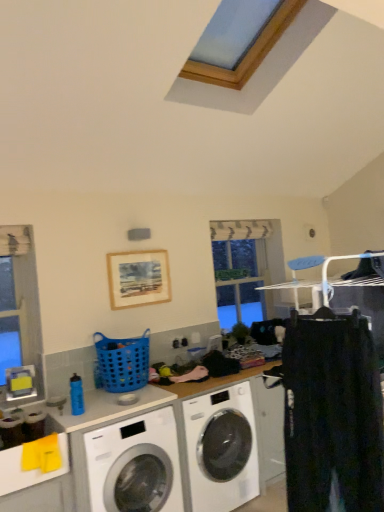
This screenshot has height=512, width=384. What do you see at coordinates (332, 413) in the screenshot?
I see `black cotton pants at right` at bounding box center [332, 413].

This screenshot has width=384, height=512. Describe the element at coordinates (222, 449) in the screenshot. I see `white glossy washing machine at center, the first washing machine in the right-to-left sequence` at that location.

What do you see at coordinates (239, 281) in the screenshot? This screenshot has width=384, height=512. I see `clear glass window at center` at bounding box center [239, 281].

I want to click on wooden picture frame at upper center, so click(138, 278).

Considering the relative positions of blue plastic basket at center and clear glass window at center in the image provided, is blue plastic basket at center to the left of clear glass window at center from the viewer's perspective?

Yes, blue plastic basket at center is to the left of clear glass window at center.

Does point (139, 349) lie in front of point (220, 263)?

Yes.

Is blue plastic basket at center far from clear glass window at center?

blue plastic basket at center is positioned a significant distance from clear glass window at center.

Could you tell me if blue plastic basket at center is facing clear glass window at center?

No, blue plastic basket at center does not turn towards clear glass window at center.

From a real-world perspective, relative to wooden picture frame at upper center, is black cotton pants at right vertically above or below?

black cotton pants at right is situated lower than wooden picture frame at upper center in the real world.

Would you consider black cotton pants at right to be distant from wooden picture frame at upper center?

Yes, black cotton pants at right and wooden picture frame at upper center are located far from each other.

Is black cotton pants at right inside or outside of wooden picture frame at upper center?

black cotton pants at right exists outside the volume of wooden picture frame at upper center.

In the scene shown: Which object is more forward, black cotton pants at right or wooden picture frame at upper center?

Positioned in front is black cotton pants at right.

Considering the relative sizes of clear glass window at center and wooden picture frame at upper center in the image provided, is clear glass window at center thinner than wooden picture frame at upper center?

No.

Is the position of clear glass window at center more distant than that of wooden picture frame at upper center?

Yes, the depth of clear glass window at center is greater than that of wooden picture frame at upper center.

Between clear glass window at center and wooden picture frame at upper center, which one has larger size?

clear glass window at center.

From the image's perspective, is clear glass window at center on top of wooden picture frame at upper center?

No, from the image's perspective, clear glass window at center is not over wooden picture frame at upper center.

Is white glossy washing machine at lower left, which is the second washing machine from right to left, at the left side of wooden picture frame at upper center?

Correct, you'll find white glossy washing machine at lower left, which is the second washing machine from right to left, to the left of wooden picture frame at upper center.

Is white glossy washing machine at lower left, which is the second washing machine from right to left, positioned with its back to wooden picture frame at upper center?

No, white glossy washing machine at lower left, which is the second washing machine from right to left, is not facing the opposite direction of wooden picture frame at upper center.

Can we say white glossy washing machine at lower left, the 1th washing machine in the left-to-right sequence, lies outside wooden picture frame at upper center?

That's correct, white glossy washing machine at lower left, the 1th washing machine in the left-to-right sequence, is outside of wooden picture frame at upper center.

Which is more to the left, white glossy washing machine at center, the 2th washing machine positioned from the left, or blue plastic basket at center?

blue plastic basket at center is more to the left.

How different are the orientations of white glossy washing machine at center, the first washing machine in the right-to-left sequence, and blue plastic basket at center in degrees?

The facing directions of white glossy washing machine at center, the first washing machine in the right-to-left sequence, and blue plastic basket at center are 3.08e-05 degrees apart.

At what (x,y) coordinates should I click in order to perform the action: click on washing machine that is the 1st object located below the blue plastic basket at center (from the image's perspective). Please return your answer as a coordinate pair (x, y). The width and height of the screenshot is (384, 512). Looking at the image, I should click on pyautogui.click(x=222, y=449).

Is white glossy washing machine at center, the first washing machine in the right-to-left sequence, positioned with its back to blue plastic basket at center?

white glossy washing machine at center, the first washing machine in the right-to-left sequence, is not turned away from blue plastic basket at center.

From the image's perspective, which is above, wooden picture frame at upper center or white glossy washing machine at lower left, which is the second washing machine from right to left?

wooden picture frame at upper center appears higher in the image.

Is white glossy washing machine at lower left, the 1th washing machine in the left-to-right sequence, a part of wooden picture frame at upper center?

No, white glossy washing machine at lower left, the 1th washing machine in the left-to-right sequence, is not surrounded by wooden picture frame at upper center.

Does wooden picture frame at upper center have a smaller size compared to white glossy washing machine at lower left, which is the second washing machine from right to left?

Yes, wooden picture frame at upper center is smaller than white glossy washing machine at lower left, which is the second washing machine from right to left.

From a real-world perspective, is white glossy washing machine at center, the first washing machine in the right-to-left sequence, beneath wooden picture frame at upper center?

Yes, from a real-world perspective, white glossy washing machine at center, the first washing machine in the right-to-left sequence, is under wooden picture frame at upper center.

Does white glossy washing machine at center, the 2th washing machine positioned from the left, have a smaller size compared to wooden picture frame at upper center?

Actually, white glossy washing machine at center, the 2th washing machine positioned from the left, might be larger than wooden picture frame at upper center.

Which object is further away from the camera taking this photo, white glossy washing machine at center, the 2th washing machine positioned from the left, or wooden picture frame at upper center?

wooden picture frame at upper center is further away from the camera.

You are a GUI agent. You are given a task and a screenshot of the screen. Output one action in this format:
    pyautogui.click(x=<x>, y=<y>)
    Task: Click on the window screen on the right of blue plastic basket at center
    The width and height of the screenshot is (384, 512).
    Given the screenshot: What is the action you would take?
    pyautogui.click(x=239, y=281)

Where is `picture frame on the left side of black cotton pants at right`? The height and width of the screenshot is (512, 384). picture frame on the left side of black cotton pants at right is located at coordinates (138, 278).

When comparing their distances from clear glass window at center, does white glossy washing machine at center, the 2th washing machine positioned from the left, or white glossy washing machine at lower left, which is the second washing machine from right to left, seem further?

white glossy washing machine at lower left, which is the second washing machine from right to left, is further to clear glass window at center.

When comparing their distances from wooden picture frame at upper center, does clear glass window at center or white glossy washing machine at center, the 2th washing machine positioned from the left, seem further?

white glossy washing machine at center, the 2th washing machine positioned from the left, is further to wooden picture frame at upper center.

Which object lies nearer to the anchor point white glossy washing machine at lower left, which is the second washing machine from right to left, blue plastic basket at center or white glossy washing machine at center, the 2th washing machine positioned from the left?

The object closer to white glossy washing machine at lower left, which is the second washing machine from right to left, is white glossy washing machine at center, the 2th washing machine positioned from the left.

Consider the image. Estimate the real-world distances between objects in this image. Which object is closer to white glossy washing machine at center, the first washing machine in the right-to-left sequence, blue plastic basket at center or black cotton pants at right?

Among the two, blue plastic basket at center is located nearer to white glossy washing machine at center, the first washing machine in the right-to-left sequence.

Estimate the real-world distances between objects in this image. Which object is closer to black cotton pants at right, blue plastic basket at center or white glossy washing machine at center, the first washing machine in the right-to-left sequence?

The object closer to black cotton pants at right is white glossy washing machine at center, the first washing machine in the right-to-left sequence.

Looking at the image, which one is located further to white glossy washing machine at lower left, the 1th washing machine in the left-to-right sequence, clear glass window at center or wooden picture frame at upper center?

clear glass window at center is further to white glossy washing machine at lower left, the 1th washing machine in the left-to-right sequence.

Based on their spatial positions, is blue plastic basket at center or clear glass window at center further from white glossy washing machine at center, the first washing machine in the right-to-left sequence?

Among the two, clear glass window at center is located further to white glossy washing machine at center, the first washing machine in the right-to-left sequence.

Looking at the image, which one is located closer to clear glass window at center, white glossy washing machine at center, the 2th washing machine positioned from the left, or blue plastic basket at center?

Based on the image, white glossy washing machine at center, the 2th washing machine positioned from the left, appears to be nearer to clear glass window at center.

Identify the location of washing machine positioned between white glossy washing machine at lower left, which is the second washing machine from right to left, and clear glass window at center from near to far. This screenshot has height=512, width=384. (222, 449).

At what (x,y) coordinates should I click in order to perform the action: click on washing machine located between black cotton pants at right and white glossy washing machine at center, the first washing machine in the right-to-left sequence, in the depth direction. Please return your answer as a coordinate pair (x, y). The width and height of the screenshot is (384, 512). Looking at the image, I should click on (130, 465).

Where is `basket between black cotton pants at right and wooden picture frame at upper center along the z-axis`? The height and width of the screenshot is (512, 384). basket between black cotton pants at right and wooden picture frame at upper center along the z-axis is located at coordinates (123, 362).

Locate an element on the screen. The image size is (384, 512). picture frame positioned between white glossy washing machine at center, the 2th washing machine positioned from the left, and clear glass window at center from near to far is located at coordinates (138, 278).